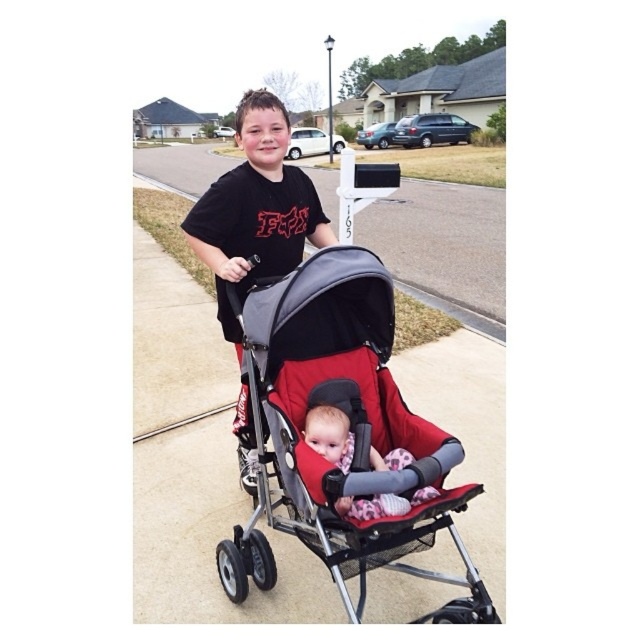
Question: Which object is the closest to the soft pink fabric baby at center?

Choices:
 (A) red fabric stroller at center
 (B) black matte t-shirt at center
 (C) gray fabric stroller at center

Answer: (A)

Question: Can you confirm if red fabric stroller at center is bigger than soft pink fabric baby at center?

Choices:
 (A) yes
 (B) no

Answer: (A)

Question: Does red fabric stroller at center have a larger size compared to gray fabric stroller at center?

Choices:
 (A) no
 (B) yes

Answer: (A)

Question: Which point appears farthest from the camera in this image?

Choices:
 (A) pyautogui.click(x=451, y=234)
 (B) pyautogui.click(x=378, y=451)
 (C) pyautogui.click(x=307, y=420)

Answer: (A)

Question: Observing the image, what is the correct spatial positioning of gray fabric stroller at center in reference to black matte t-shirt at center?

Choices:
 (A) above
 (B) below

Answer: (A)

Question: Which point is farther to the camera?

Choices:
 (A) red fabric stroller at center
 (B) soft pink fabric baby at center

Answer: (B)